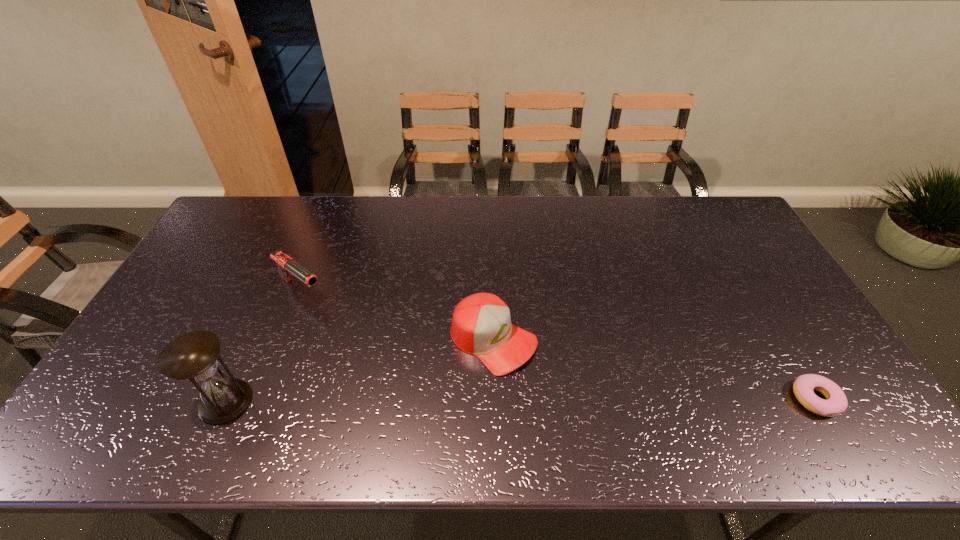
Locate an element on the screen. the tallest object is located at coordinates (193, 356).

Where is `the shortest object`? The height and width of the screenshot is (540, 960). the shortest object is located at coordinates (836, 403).

This screenshot has height=540, width=960. I want to click on the rightmost object, so click(x=836, y=403).

Image resolution: width=960 pixels, height=540 pixels. Find the location of `gun`. gun is located at coordinates (286, 265).

Where is `baseball cap`? The height and width of the screenshot is (540, 960). baseball cap is located at coordinates (481, 324).

I want to click on free space located on the right of the hourglass, so click(366, 402).

Find the location of a particular element. blank space located on the left of the doughnut is located at coordinates (638, 399).

Where is `vacant space positioned at the aiming end of the gun`? vacant space positioned at the aiming end of the gun is located at coordinates (x=341, y=317).

At what (x,y) coordinates should I click in order to perform the action: click on vacant region located 0.370m at the aiming end of the gun. Please return your answer as a coordinate pair (x, y). The image size is (960, 540). Looking at the image, I should click on (407, 367).

You are a GUI agent. You are given a task and a screenshot of the screen. Output one action in this format:
    pyautogui.click(x=<x>, y=<y>)
    Task: Click on the vacant space located at the aiming end of the gun
    
    Given the screenshot: What is the action you would take?
    pyautogui.click(x=332, y=310)